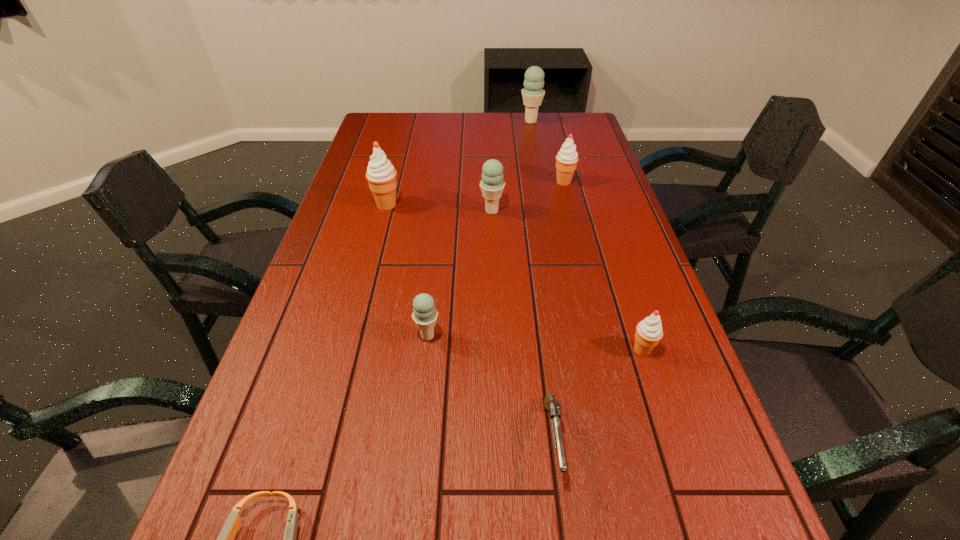
Where is `free space between the rightmost object and the second smallest blue ice cream`? free space between the rightmost object and the second smallest blue ice cream is located at coordinates (567, 280).

Find the location of `empty space between the fifth object from left to right and the farthest ice cream`. empty space between the fifth object from left to right and the farthest ice cream is located at coordinates point(541,280).

Locate an element on the screen. The width and height of the screenshot is (960, 540). free area in between the second biggest blue ice cream and the second shortest object is located at coordinates (522, 325).

This screenshot has height=540, width=960. I want to click on free space between the second nearest red icecream and the biggest blue ice cream, so click(459, 163).

The width and height of the screenshot is (960, 540). I want to click on vacant space that's between the fourth object from right to left and the fourth object from left to right, so click(x=522, y=325).

What are the coordinates of `object identified as the third closest to the farthest blue ice cream` in the screenshot? It's located at (381, 175).

Find the location of a particular element. This screenshot has width=960, height=540. object identified as the second closest to the second smallest blue ice cream is located at coordinates (381, 175).

Choose which ice cream is the nearest neighbor to the leftmost ice cream. Please provide its 2D coordinates. Your answer should be formatted as a tuple, i.e. [(x, y)], where the tuple contains the x and y coordinates of a point satisfying the conditions above.

[(492, 184)]

Identify which ice cream is the sixth closest to the second nearest object. Please provide its 2D coordinates. Your answer should be formatted as a tuple, i.e. [(x, y)], where the tuple contains the x and y coordinates of a point satisfying the conditions above.

[(533, 94)]

Point out which blue ice cream is positioned as the second nearest to the gun. Please provide its 2D coordinates. Your answer should be formatted as a tuple, i.e. [(x, y)], where the tuple contains the x and y coordinates of a point satisfying the conditions above.

[(492, 184)]